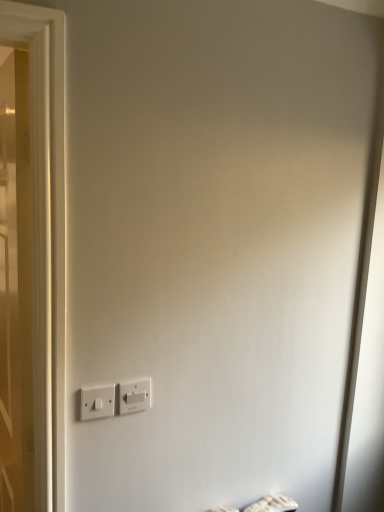
Question: Would you say white plastic power plugs and sockets at lower left, which is counted as the second power plugs and sockets, starting from the right, is to the left or to the right of white wooden door at left in the picture?

Choices:
 (A) left
 (B) right

Answer: (B)

Question: From their relative heights in the image, would you say white plastic power plugs and sockets at lower left, which is counted as the second power plugs and sockets, starting from the right, is taller or shorter than white wooden door at left?

Choices:
 (A) short
 (B) tall

Answer: (A)

Question: Based on their relative distances, which object is nearer to the white plastic power plugs and sockets at lower left, which is counted as the second power plugs and sockets, starting from the right?

Choices:
 (A) white wooden door at left
 (B) white plastic power plugs and sockets at lower center, the 2th power plugs and sockets when ordered from left to right

Answer: (B)

Question: Estimate the real-world distances between objects in this image. Which object is closer to the white plastic power plugs and sockets at lower left, which is counted as the second power plugs and sockets, starting from the right?

Choices:
 (A) white plastic power plugs and sockets at lower center, the 2th power plugs and sockets when ordered from left to right
 (B) white wooden door at left

Answer: (A)